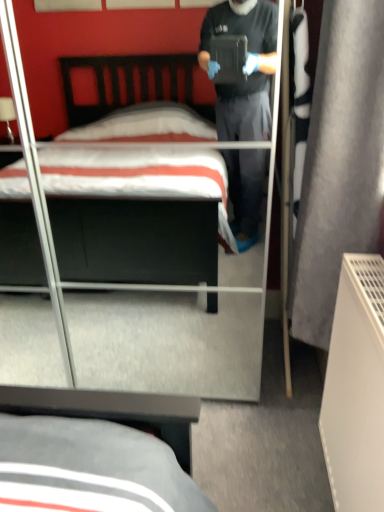
Question: Does point (215, 252) appear closer or farther from the camera than point (331, 233)?

Choices:
 (A) closer
 (B) farther

Answer: (B)

Question: From a real-world perspective, is matte black bed at center positioned above or below gray fabric curtain at right?

Choices:
 (A) below
 (B) above

Answer: (A)

Question: In terms of height, does matte black bed at center look taller or shorter compared to gray fabric curtain at right?

Choices:
 (A) tall
 (B) short

Answer: (A)

Question: From a real-world perspective, relative to matte black bed at center, is gray fabric curtain at right vertically above or below?

Choices:
 (A) above
 (B) below

Answer: (A)

Question: Based on their sizes in the image, would you say gray fabric curtain at right is bigger or smaller than matte black bed at center?

Choices:
 (A) small
 (B) big

Answer: (A)

Question: Is gray fabric curtain at right inside the boundaries of matte black bed at center, or outside?

Choices:
 (A) inside
 (B) outside

Answer: (B)

Question: Does point (352, 68) appear closer or farther from the camera than point (92, 273)?

Choices:
 (A) closer
 (B) farther

Answer: (A)